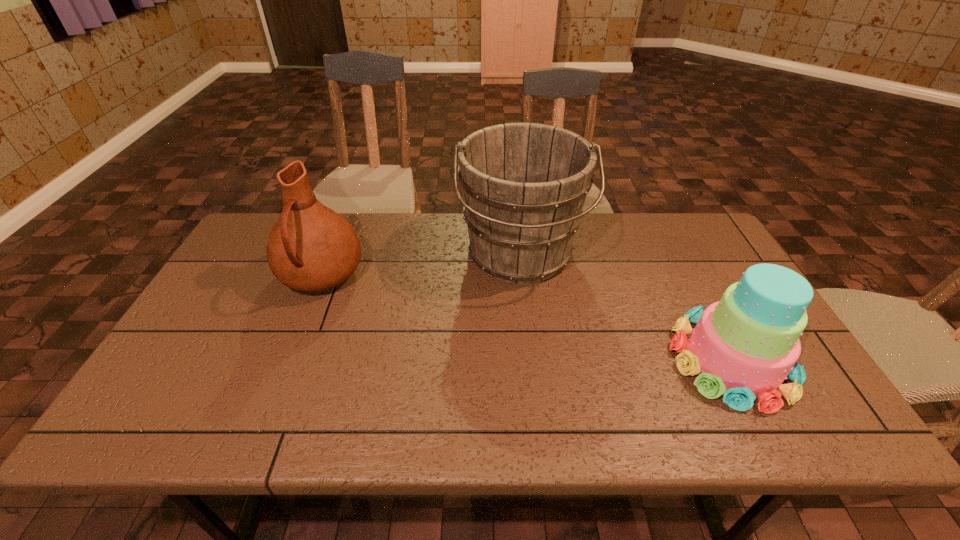
Find the location of a particular element. The height and width of the screenshot is (540, 960). free space between the pitcher and the bucket is located at coordinates (420, 265).

The height and width of the screenshot is (540, 960). In order to click on vacant region between the leftmost object and the second object from right to left in this screenshot , I will do `click(420, 265)`.

Find the location of a particular element. The image size is (960, 540). vacant space that's between the shortest object and the leftmost object is located at coordinates (526, 318).

Identify the location of vacant point located between the leftmost object and the second object from left to right. (420, 265).

Locate an element on the screen. Image resolution: width=960 pixels, height=540 pixels. vacant space in between the rightmost object and the pitcher is located at coordinates (526, 318).

The width and height of the screenshot is (960, 540). Find the location of `free space between the leftmost object and the bucket`. free space between the leftmost object and the bucket is located at coordinates (420, 265).

Identify which object is the closest to the leftmost object. Please provide its 2D coordinates. Your answer should be formatted as a tuple, i.e. [(x, y)], where the tuple contains the x and y coordinates of a point satisfying the conditions above.

[(524, 185)]

You are a GUI agent. You are given a task and a screenshot of the screen. Output one action in this format:
    pyautogui.click(x=<x>, y=<y>)
    Task: Click on the closest object relative to the leftmost object
    
    Given the screenshot: What is the action you would take?
    pyautogui.click(x=524, y=185)

Where is `free spot that satisfies the following two spatial constraints: 1. on the side of the pitcher with the handle; 2. on the right side of the rightmost object`? The image size is (960, 540). free spot that satisfies the following two spatial constraints: 1. on the side of the pitcher with the handle; 2. on the right side of the rightmost object is located at coordinates (288, 359).

This screenshot has height=540, width=960. Identify the location of free space that satisfies the following two spatial constraints: 1. on the handle side of the second object from right to left; 2. on the right side of the nearest object. (531, 359).